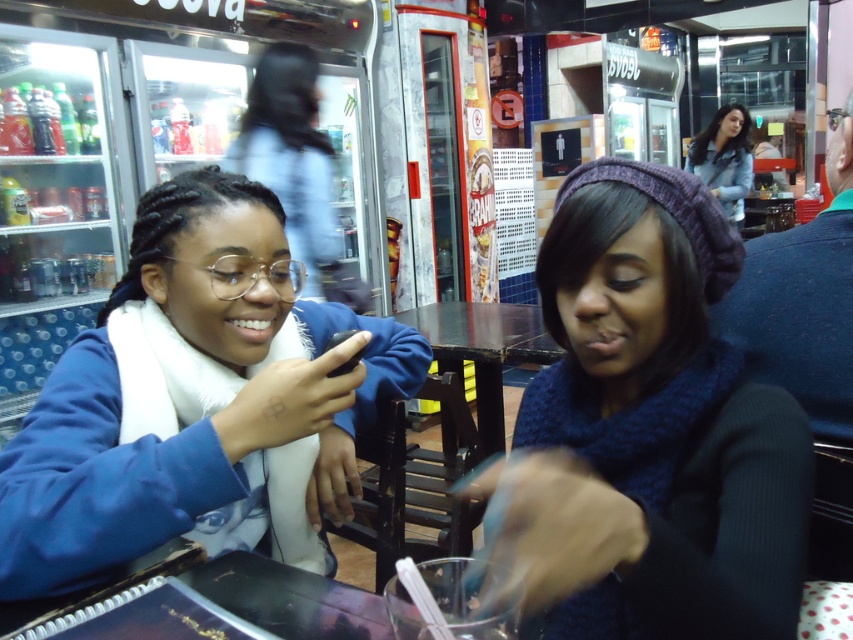
Does dark wood table at center appear under denim jacket at upper right?

Indeed, dark wood table at center is positioned under denim jacket at upper right.

Between dark wood table at center and denim jacket at upper right, which one has less height?

dark wood table at center is shorter.

This screenshot has width=853, height=640. What do you see at coordinates (483, 349) in the screenshot?
I see `dark wood table at center` at bounding box center [483, 349].

Locate an element on the screen. Image resolution: width=853 pixels, height=640 pixels. dark wood table at center is located at coordinates (483, 349).

Between knitted purple beanie at upper right and dark wood table at center, which one has more height?

knitted purple beanie at upper right is taller.

Does knitted purple beanie at upper right have a greater height compared to dark wood table at center?

Yes, knitted purple beanie at upper right is taller than dark wood table at center.

I want to click on knitted purple beanie at upper right, so click(653, 428).

Which of these two, knitted purple beanie at upper right or blue fleece jacket at left, stands taller?

blue fleece jacket at left

Is knitted purple beanie at upper right wider than blue fleece jacket at left?

In fact, knitted purple beanie at upper right might be narrower than blue fleece jacket at left.

Which is behind, point (703, 310) or point (287, 481)?

The point (287, 481) is behind.

Locate an element on the screen. The width and height of the screenshot is (853, 640). knitted purple beanie at upper right is located at coordinates (653, 428).